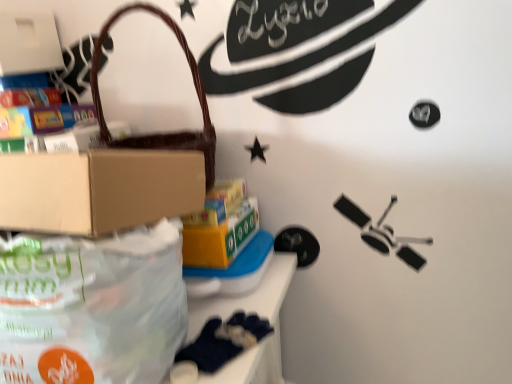
Question: Is white matte box at upper left, which is counted as the second box, starting from the right, positioned beyond the bounds of translucent plastic bag at lower left?

Choices:
 (A) yes
 (B) no

Answer: (A)

Question: Is white matte box at upper left, the 2th box from the bottom, not close to translucent plastic bag at lower left?

Choices:
 (A) yes
 (B) no

Answer: (B)

Question: Considering the relative positions of white matte box at upper left, which is counted as the second box, starting from the right, and translucent plastic bag at lower left in the image provided, is white matte box at upper left, which is counted as the second box, starting from the right, to the right of translucent plastic bag at lower left from the viewer's perspective?

Choices:
 (A) no
 (B) yes

Answer: (A)

Question: Can you confirm if white matte box at upper left, which is counted as the second box, starting from the right, is wider than translucent plastic bag at lower left?

Choices:
 (A) yes
 (B) no

Answer: (B)

Question: Can you confirm if white matte box at upper left, which is counted as the second box, starting from the right, is shorter than translucent plastic bag at lower left?

Choices:
 (A) no
 (B) yes

Answer: (B)

Question: From a real-world perspective, is white matte box at upper left, marked as the 1th box in a top-to-bottom arrangement, over translucent plastic bag at lower left?

Choices:
 (A) no
 (B) yes

Answer: (B)

Question: From the image's perspective, is dark blue fabric at lower left on top of yellow cardboard box at center, placed as the 2th box when sorted from left to right?

Choices:
 (A) no
 (B) yes

Answer: (A)

Question: Does dark blue fabric at lower left contain yellow cardboard box at center, which appears as the second box when viewed from the top?

Choices:
 (A) no
 (B) yes

Answer: (A)

Question: From the image's perspective, does dark blue fabric at lower left appear lower than yellow cardboard box at center, placed as the 2th box when sorted from left to right?

Choices:
 (A) no
 (B) yes

Answer: (B)

Question: Considering the relative sizes of dark blue fabric at lower left and yellow cardboard box at center, which is counted as the 1th box, starting from the right, in the image provided, is dark blue fabric at lower left shorter than yellow cardboard box at center, which is counted as the 1th box, starting from the right,?

Choices:
 (A) yes
 (B) no

Answer: (A)

Question: From a real-world perspective, is dark blue fabric at lower left located beneath yellow cardboard box at center, which is counted as the 1th box, starting from the right?

Choices:
 (A) no
 (B) yes

Answer: (B)

Question: Is dark blue fabric at lower left smaller than yellow cardboard box at center, the first box ordered from the bottom?

Choices:
 (A) no
 (B) yes

Answer: (B)

Question: Is dark blue fabric at lower left oriented away from white matte box at upper left, which is counted as the second box, starting from the right?

Choices:
 (A) yes
 (B) no

Answer: (B)